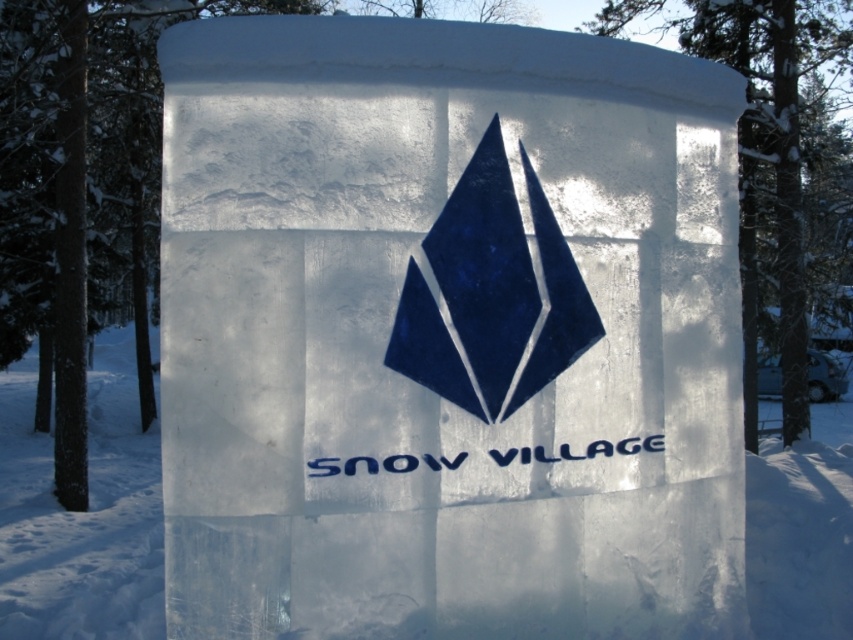
Is transparent ice at center to the right of blue glossy diamond at center from the viewer's perspective?

Indeed, transparent ice at center is positioned on the right side of blue glossy diamond at center.

This screenshot has width=853, height=640. Describe the element at coordinates (80, 513) in the screenshot. I see `transparent ice at center` at that location.

This screenshot has height=640, width=853. In order to click on transparent ice at center in this screenshot , I will do click(80, 513).